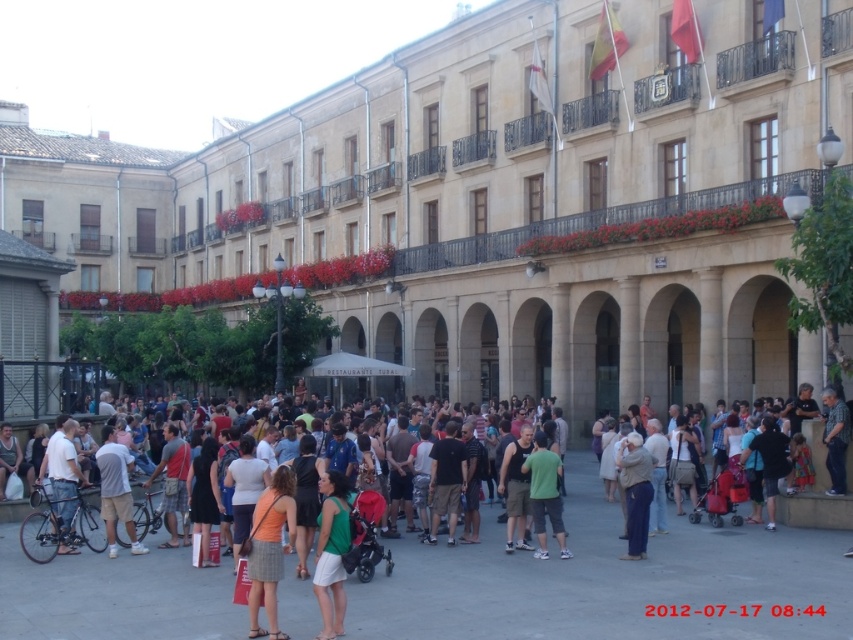
Question: Where is green cotton shirt at center located in relation to light gray cotton shirt at center in the image?

Choices:
 (A) left
 (B) right

Answer: (B)

Question: Can you confirm if green matte dress at lower center is thinner than light gray cotton shirt at center?

Choices:
 (A) no
 (B) yes

Answer: (A)

Question: Which of the following is the closest to the observer?

Choices:
 (A) (335, 573)
 (B) (657, 545)

Answer: (A)

Question: Which of these objects is positioned closest to the matte black bicycle at lower left?

Choices:
 (A) orange fabric skirt at center
 (B) light beige fabric at center
 (C) green cotton shirt at center
 (D) green matte dress at lower center

Answer: (C)

Question: Does orange fabric skirt at center have a greater width compared to green matte shirt at center?

Choices:
 (A) no
 (B) yes

Answer: (A)

Question: Among these points, which one is farthest from the camera?

Choices:
 (A) (140, 572)
 (B) (105, 484)
 (C) (631, 556)

Answer: (B)